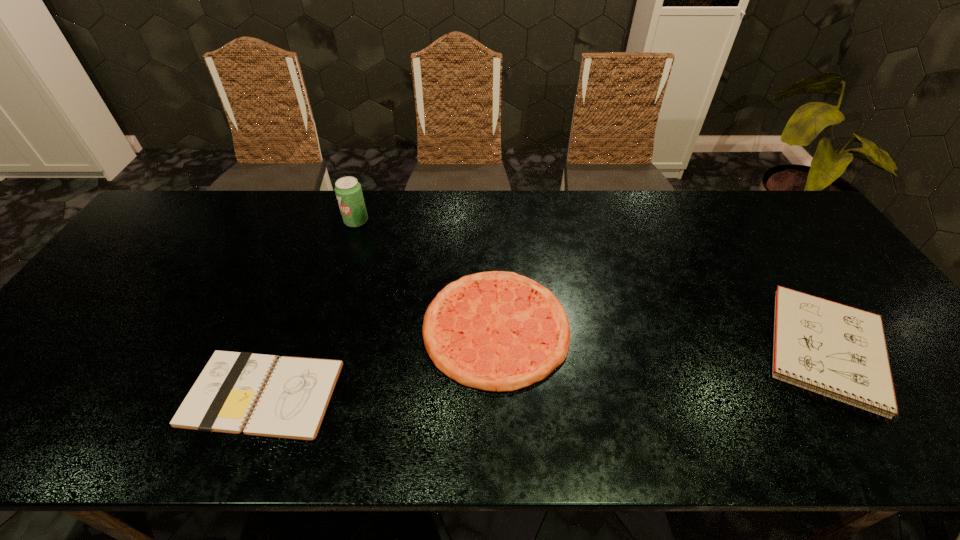
At what (x,y) coordinates should I click in order to perform the action: click on free space between the third object from left to right and the tallest object. Please return your answer as a coordinate pair (x, y). Image resolution: width=960 pixels, height=540 pixels. Looking at the image, I should click on (426, 274).

This screenshot has height=540, width=960. Identify the location of unoccupied area between the shorter notepad and the soda. (309, 308).

This screenshot has height=540, width=960. Identify the location of vacant space that's between the shortest object and the farthest object. (309, 308).

The image size is (960, 540). I want to click on vacant area that lies between the soda and the pizza, so click(x=426, y=274).

Identify the location of free space between the pizza and the taller notepad. (661, 339).

Where is `unoccupied position between the third object from left to right and the soda`? Image resolution: width=960 pixels, height=540 pixels. unoccupied position between the third object from left to right and the soda is located at coordinates (426, 274).

Where is `empty location between the second shortest object and the shorter notepad`? The image size is (960, 540). empty location between the second shortest object and the shorter notepad is located at coordinates (379, 361).

This screenshot has width=960, height=540. I want to click on vacant point located between the second object from right to left and the tallest object, so click(426, 274).

Identify the location of the second closest object to the shorter notepad. (348, 190).

Locate an element on the screen. The width and height of the screenshot is (960, 540). object identified as the third closest to the shorter notepad is located at coordinates coord(835,350).